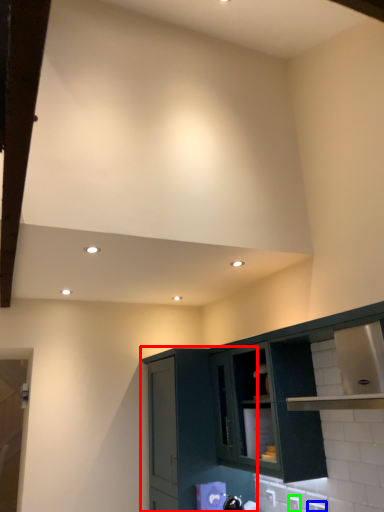
Question: Considering the real-world distances, which object is closest to cabinetry (highlighted by a red box)? electric outlet (highlighted by a blue box) or electric outlet (highlighted by a green box).

Choices:
 (A) electric outlet
 (B) electric outlet

Answer: (B)